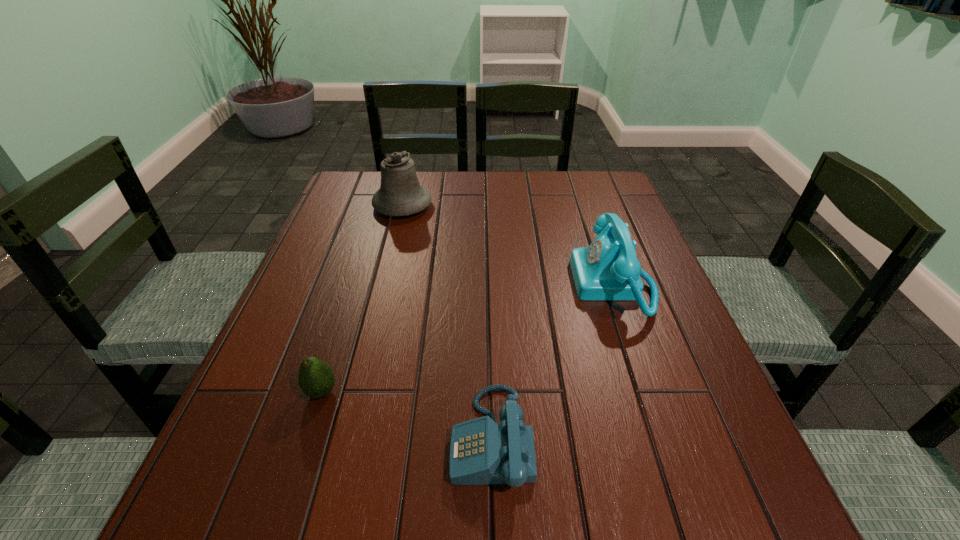
Locate an element on the screen. The width and height of the screenshot is (960, 540). free space between the farthest object and the avocado is located at coordinates coord(362,299).

Image resolution: width=960 pixels, height=540 pixels. I want to click on free point between the nearer telephone and the second farthest object, so click(x=553, y=361).

The height and width of the screenshot is (540, 960). I want to click on free space between the farthest object and the taller telephone, so click(x=509, y=245).

Identify the location of free spot between the avocado and the bell. This screenshot has height=540, width=960. tap(362, 299).

The height and width of the screenshot is (540, 960). I want to click on empty space between the third object from left to right and the farthest object, so click(447, 322).

Find the location of a particular element. vacant space in between the avocado and the right telephone is located at coordinates (468, 339).

Identify the location of object that is the closest one to the avocado. Image resolution: width=960 pixels, height=540 pixels. click(482, 452).

At what (x,y) coordinates should I click in order to perform the action: click on object that is the nearest to the avocado. Please return your answer as a coordinate pair (x, y). The width and height of the screenshot is (960, 540). Looking at the image, I should click on (482, 452).

Where is `free spot that satisfies the following two spatial constraints: 1. on the dial of the farther telephone; 2. on the front side of the avocado`? Image resolution: width=960 pixels, height=540 pixels. free spot that satisfies the following two spatial constraints: 1. on the dial of the farther telephone; 2. on the front side of the avocado is located at coordinates (651, 392).

At what (x,y) coordinates should I click in order to perform the action: click on free location that satisfies the following two spatial constraints: 1. on the dial of the second farthest object; 2. on the front side of the avocado. Please return your answer as a coordinate pair (x, y). The width and height of the screenshot is (960, 540). Looking at the image, I should click on (651, 392).